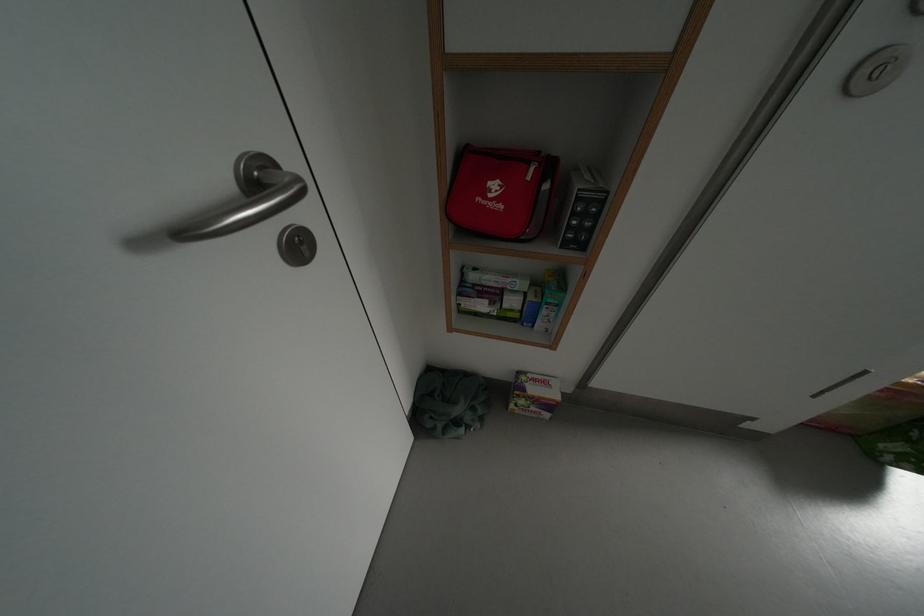
Which object does [502,191] point to?

It refers to a red first-aid pouch.